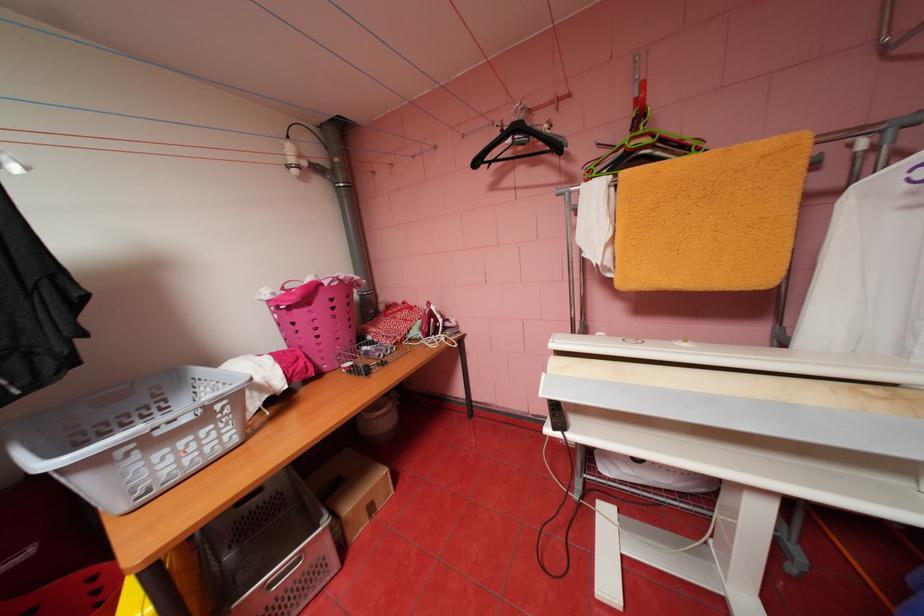
The width and height of the screenshot is (924, 616). Identify the location of black power switch. (556, 416).